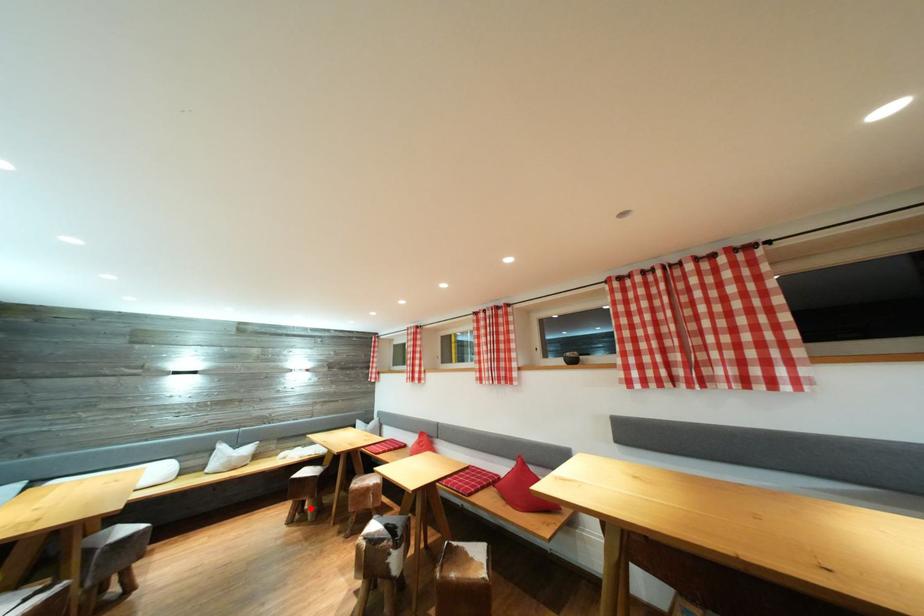
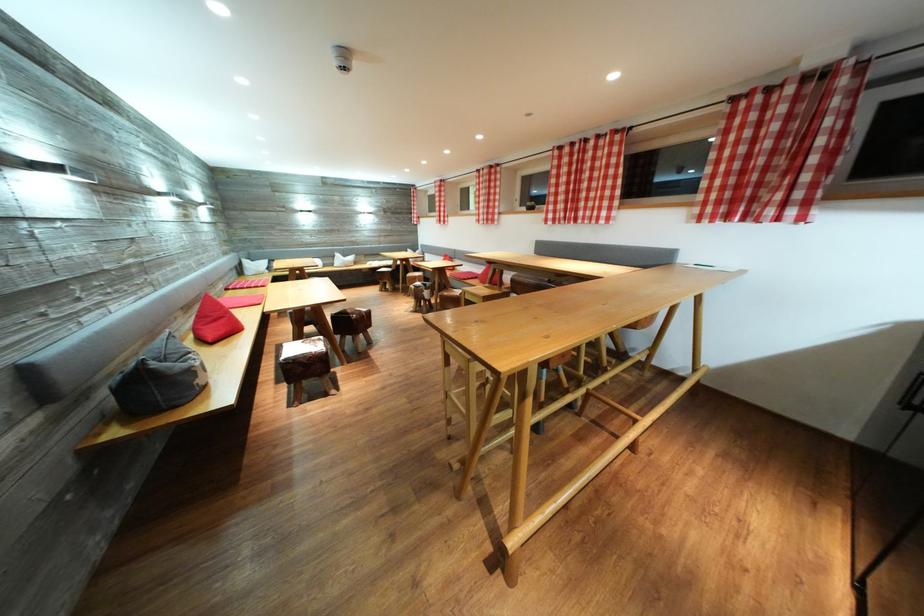
Question: I am providing you with two images of the same scene from different viewpoints. Given a red point in image1, look at the same physical point in image2. Is it:

Choices:
 (A) Closer to the viewpoint
 (B) Farther from the viewpoint

Answer: (A)